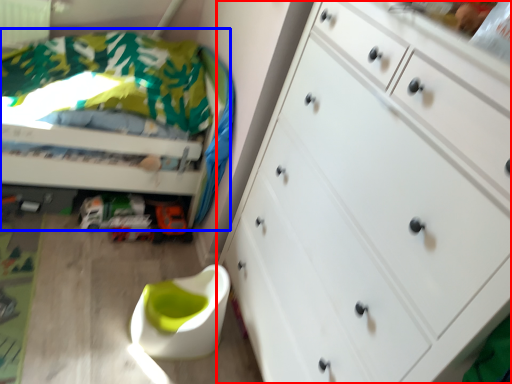
Question: Which of the following is the closest to the observer, chest of drawers (highlighted by a red box) or bed (highlighted by a blue box)?

Choices:
 (A) chest of drawers
 (B) bed

Answer: (A)